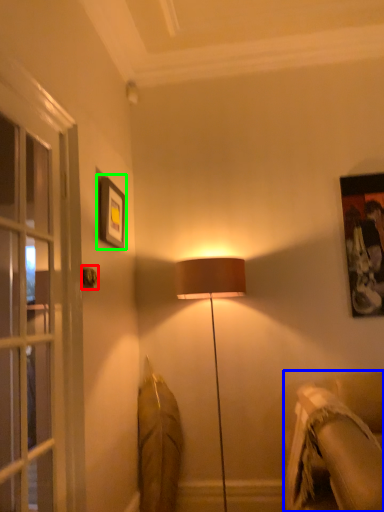
Question: Based on their relative distances, which object is nearer to door handle (highlighted by a red box)? Choose from studio couch (highlighted by a blue box) and picture frame (highlighted by a green box).

Choices:
 (A) studio couch
 (B) picture frame

Answer: (B)